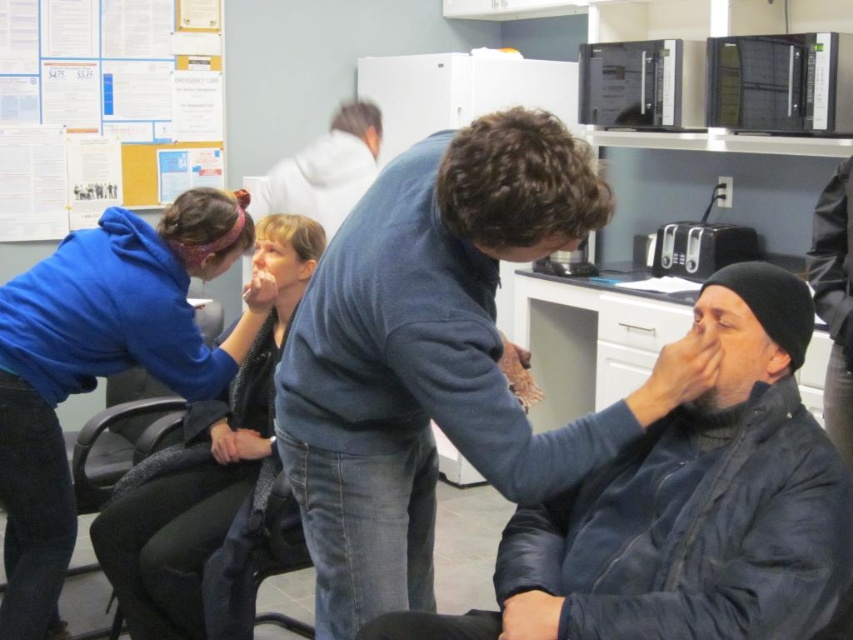
Does white paperboard at upper left appear under matte blue hoodie at left?

No.

Does white paperboard at upper left appear over matte blue hoodie at left?

Yes, white paperboard at upper left is above matte blue hoodie at left.

Where is `white paperboard at upper left`? The height and width of the screenshot is (640, 853). white paperboard at upper left is located at coordinates pyautogui.click(x=105, y=108).

Where is `white paperboard at upper left`? This screenshot has height=640, width=853. white paperboard at upper left is located at coordinates (105, 108).

From the picture: Who is more forward, (711, 632) or (177, 132)?

Point (711, 632) is in front.

Can you confirm if dark blue jacket at lower right is thinner than white paperboard at upper left?

Correct, dark blue jacket at lower right's width is less than white paperboard at upper left's.

This screenshot has height=640, width=853. Describe the element at coordinates (689, 508) in the screenshot. I see `dark blue jacket at lower right` at that location.

The image size is (853, 640). In order to click on dark blue jacket at lower right in this screenshot , I will do `click(689, 508)`.

Where is `dark blue jacket at lower right`? This screenshot has height=640, width=853. dark blue jacket at lower right is located at coordinates (689, 508).

Is dark blue jacket at lower right bigger than matte blue hoodie at left?

Incorrect, dark blue jacket at lower right is not larger than matte blue hoodie at left.

In order to click on dark blue jacket at lower right in this screenshot , I will do `click(689, 508)`.